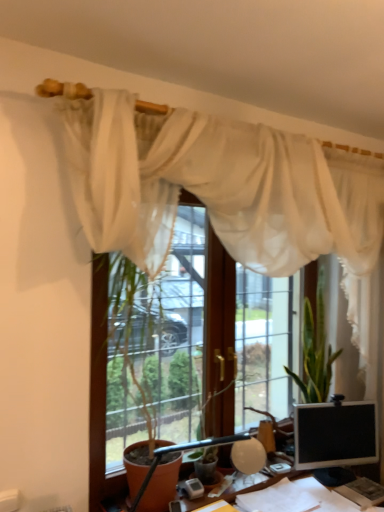
Question: In terms of size, does green leafy plant at center appear bigger or smaller than matte black monitor at lower right?

Choices:
 (A) big
 (B) small

Answer: (A)

Question: Is green leafy plant at center to the left or to the right of matte black monitor at lower right in the image?

Choices:
 (A) left
 (B) right

Answer: (A)

Question: Estimate the real-world distances between objects in this image. Which object is farther from the matte black table lamp at center?

Choices:
 (A) transparent glass window at center
 (B) wooden desk at lower center
 (C) sheer white curtain at upper center
 (D) matte black monitor at lower right
 (E) green leafy plant at center

Answer: (C)

Question: Which object is the closest to the transparent glass window at center?

Choices:
 (A) matte black monitor at lower right
 (B) sheer white curtain at upper center
 (C) wooden desk at lower center
 (D) green leafy plant at center
 (E) matte black table lamp at center

Answer: (C)